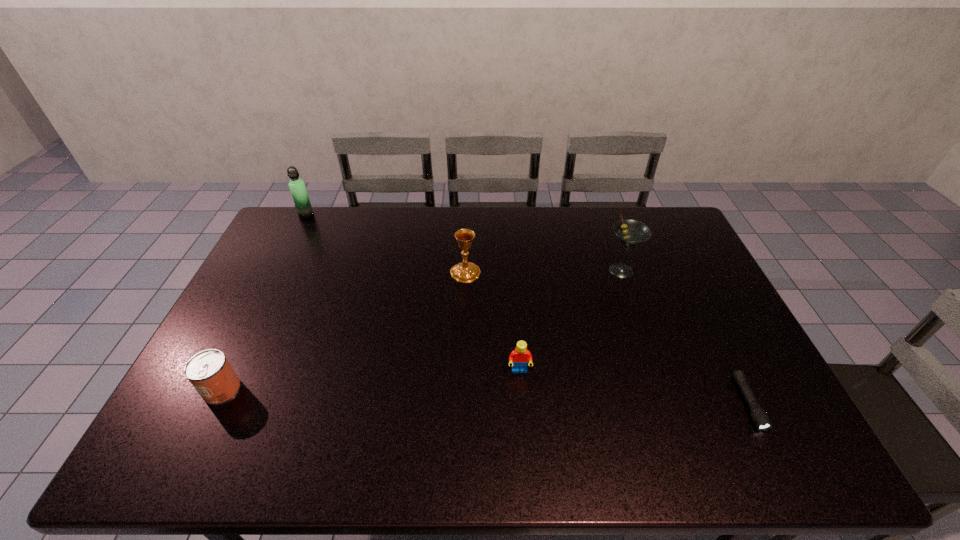
The width and height of the screenshot is (960, 540). I want to click on free region located 0.330m on the front of the fourth shortest object, so click(462, 367).

Where is `vacant area situated on the face of the fourth object from left to right`? The image size is (960, 540). vacant area situated on the face of the fourth object from left to right is located at coordinates (522, 403).

Locate an element on the screen. vacant region located 0.260m on the back of the can is located at coordinates (264, 305).

Where is `free spot located at the lens end of the shortest object`? The width and height of the screenshot is (960, 540). free spot located at the lens end of the shortest object is located at coordinates (774, 457).

The height and width of the screenshot is (540, 960). I want to click on object present at the far edge, so click(x=297, y=187).

At what (x,y) coordinates should I click in order to perform the action: click on thermos bottle that is at the left edge. Please return your answer as a coordinate pair (x, y). The height and width of the screenshot is (540, 960). Looking at the image, I should click on (297, 187).

Locate an element on the screen. Image resolution: width=960 pixels, height=540 pixels. can located in the left edge section of the desktop is located at coordinates (209, 371).

Identify the location of object that is at the right edge. (760, 418).

In order to click on object that is at the far left corner in this screenshot , I will do `click(297, 187)`.

Locate an element on the screen. The height and width of the screenshot is (540, 960). vacant area at the far edge is located at coordinates (526, 218).